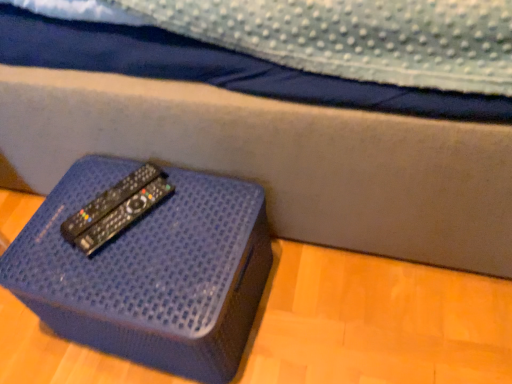
Question: From a real-world perspective, is blue textured box at lower left above or below black plastic remote at center?

Choices:
 (A) below
 (B) above

Answer: (A)

Question: Is blue textured box at lower left in front of or behind black plastic remote at center in the image?

Choices:
 (A) behind
 (B) front

Answer: (B)

Question: Is blue textured box at lower left wider or thinner than black plastic remote at center?

Choices:
 (A) wide
 (B) thin

Answer: (A)

Question: From a real-world perspective, is black plastic remote at center physically located above or below blue textured box at lower left?

Choices:
 (A) below
 (B) above

Answer: (B)

Question: Looking at their shapes, would you say black plastic remote at center is wider or thinner than blue textured box at lower left?

Choices:
 (A) thin
 (B) wide

Answer: (A)

Question: Considering the positions of black plastic remote at center and blue textured box at lower left in the image, is black plastic remote at center taller or shorter than blue textured box at lower left?

Choices:
 (A) tall
 (B) short

Answer: (B)

Question: Is black plastic remote at center spatially inside blue textured box at lower left, or outside of it?

Choices:
 (A) outside
 (B) inside

Answer: (A)